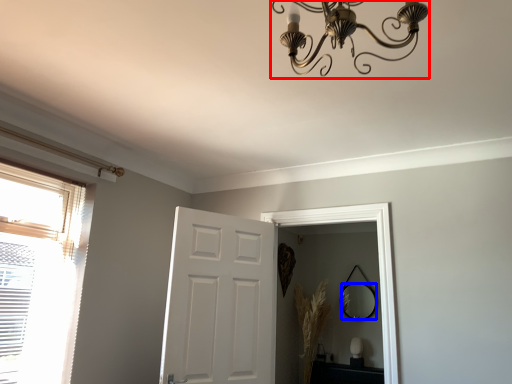
Question: Which object is further to the camera taking this photo, light fixture (highlighted by a red box) or mirror (highlighted by a blue box)?

Choices:
 (A) light fixture
 (B) mirror

Answer: (B)